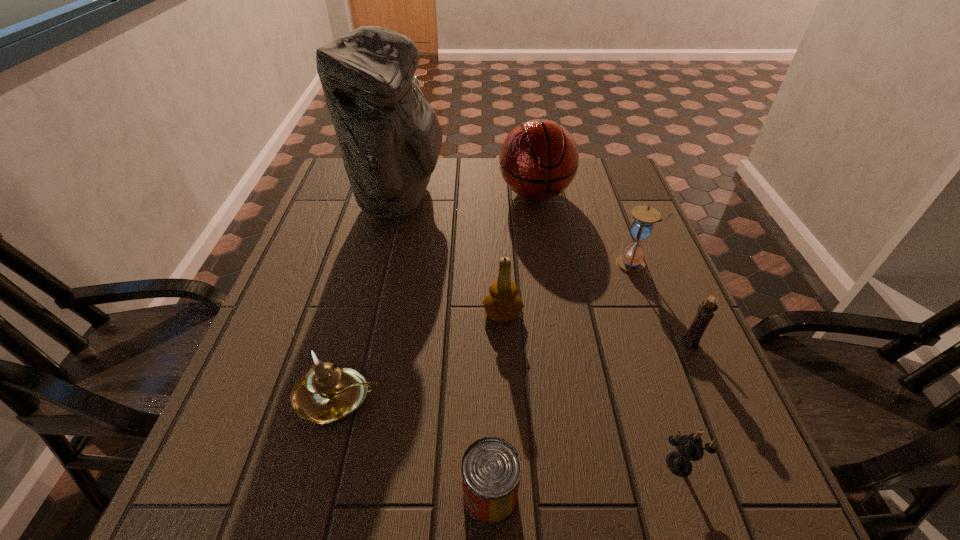
The height and width of the screenshot is (540, 960). Find the location of `free space at the near edge of the desktop`. free space at the near edge of the desktop is located at coordinates (626, 514).

In the image, there is a desktop. What are the coordinates of `vacant region at the left edge` in the screenshot? It's located at (290, 381).

Where is `vacant space at the right edge of the desktop`? The height and width of the screenshot is (540, 960). vacant space at the right edge of the desktop is located at coordinates (591, 214).

The width and height of the screenshot is (960, 540). Find the location of `free space at the far right corner of the desktop`. free space at the far right corner of the desktop is located at coordinates (585, 190).

The width and height of the screenshot is (960, 540). I want to click on free spot at the near right corner of the desktop, so click(731, 510).

At what (x,y) coordinates should I click in order to perform the action: click on free space between the seventh shortest object and the farthest candle holder. Please return your answer as a coordinate pair (x, y). Looking at the image, I should click on (519, 253).

Locate an element on the screen. This screenshot has width=960, height=540. vacant space that's between the seventh shortest object and the second candle holder from left to right is located at coordinates (519, 253).

Find the location of a particular element. Image resolution: width=960 pixels, height=540 pixels. free area in between the farthest candle holder and the seventh shortest object is located at coordinates (519, 253).

Where is `vacant space in between the fifth nearest object and the tallest object`? This screenshot has height=540, width=960. vacant space in between the fifth nearest object and the tallest object is located at coordinates (x=451, y=255).

Where is `free space that is in between the leftmost candle holder and the sixth nearest object`? free space that is in between the leftmost candle holder and the sixth nearest object is located at coordinates (485, 330).